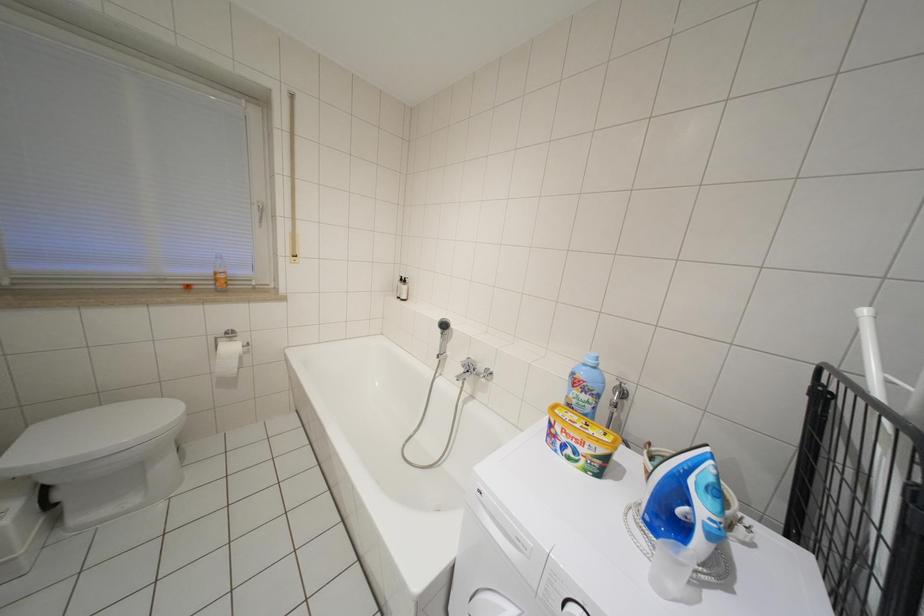
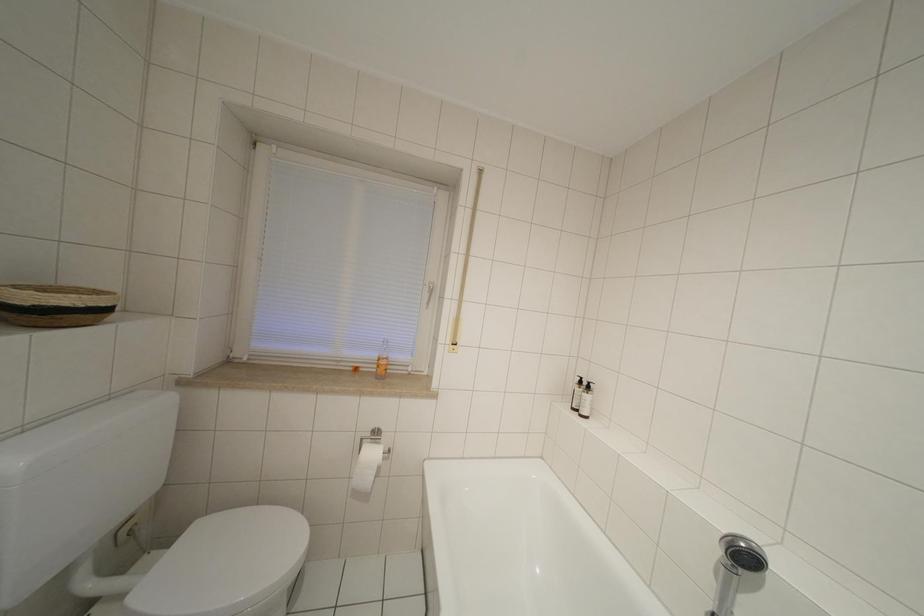
Question: How did the camera likely rotate?

Choices:
 (A) Left
 (B) Right
 (C) Up
 (D) Down

Answer: (A)